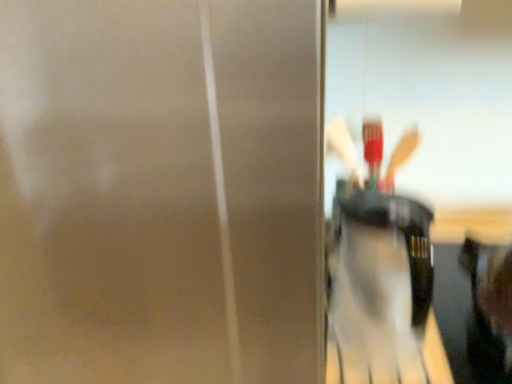
Question: Considering their positions, is smooth black hair at right located in front of or behind translucent plastic cup at center?

Choices:
 (A) behind
 (B) front

Answer: (B)

Question: Choose the correct answer: Is smooth black hair at right inside translucent plastic cup at center or outside it?

Choices:
 (A) inside
 (B) outside

Answer: (B)

Question: Which object is the farthest from the smooth black hair at right?

Choices:
 (A) matte silver screen door at center
 (B) translucent plastic cup at center

Answer: (A)

Question: Which of these objects is positioned farthest from the smooth black hair at right?

Choices:
 (A) translucent plastic cup at center
 (B) matte silver screen door at center

Answer: (B)